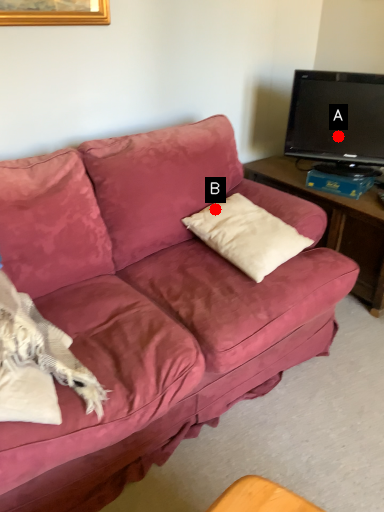
Question: Two points are circled on the image, labeled by A and B beside each circle. Which of the following is the farthest from the observer?

Choices:
 (A) A is further
 (B) B is further

Answer: (A)